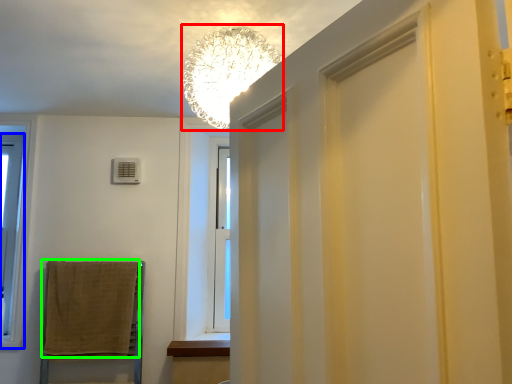
Question: Considering the real-world distances, which object is farthest from lamp (highlighted by a red box)? window (highlighted by a blue box) or bath towel (highlighted by a green box)?

Choices:
 (A) window
 (B) bath towel

Answer: (A)